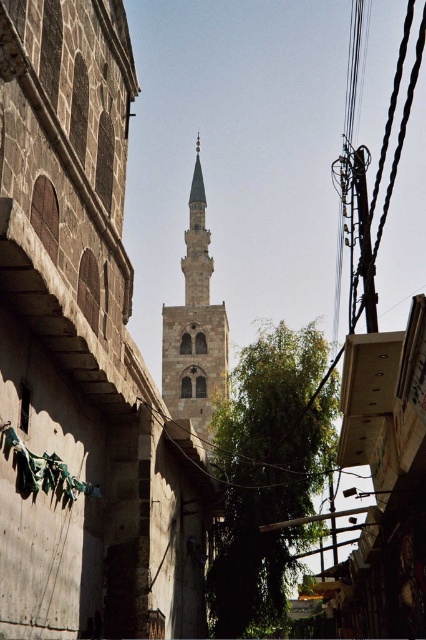
Is brown stone minaret at center positioned at the back of smooth white minaret at center?

No.

Is brown stone minaret at center below smooth white minaret at center?

Correct, brown stone minaret at center is located below smooth white minaret at center.

The height and width of the screenshot is (640, 426). In order to click on brown stone minaret at center in this screenshot , I will do `click(89, 355)`.

Who is taller, stone minaret at center or black wire at right?

black wire at right

Where is `stone minaret at center`? This screenshot has width=426, height=640. stone minaret at center is located at coordinates (195, 326).

Is stone minaret at center to the left of smooth white minaret at center from the viewer's perspective?

No, stone minaret at center is not to the left of smooth white minaret at center.

Is stone minaret at center to the right of smooth white minaret at center from the viewer's perspective?

Yes, stone minaret at center is to the right of smooth white minaret at center.

Image resolution: width=426 pixels, height=640 pixels. Find the location of `stone minaret at center`. stone minaret at center is located at coordinates (195, 326).